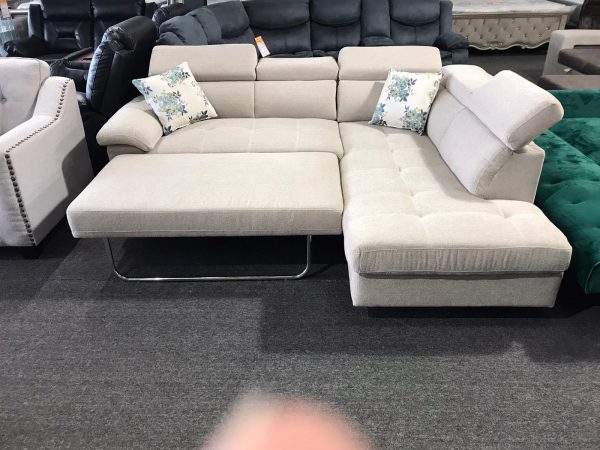
Find the location of `black sectional`. black sectional is located at coordinates (275, 51), (371, 27), (220, 16).